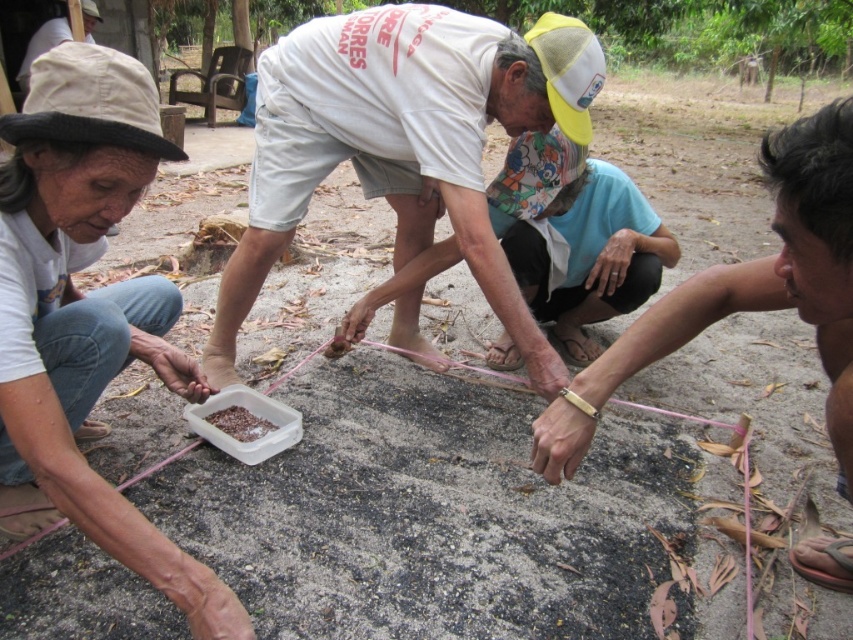
Is white cotton shirt at center below white cotton shirt at lower left?

No, white cotton shirt at center is not below white cotton shirt at lower left.

Identify the location of white cotton shirt at center. (404, 141).

The image size is (853, 640). Identify the location of white cotton shirt at center. (404, 141).

Is gray concrete rock at lower left positioned behind brown matte food at center?

No, it is in front of brown matte food at center.

Between gray concrete rock at lower left and brown matte food at center, which one appears on the left side from the viewer's perspective?

brown matte food at center

Which is behind, point (323, 452) or point (267, 422)?

The point (267, 422) is more distant.

You are a GUI agent. You are given a task and a screenshot of the screen. Output one action in this format:
    pyautogui.click(x=<x>, y=<y>)
    Task: Click on the gray concrete rock at lower left
    The height and width of the screenshot is (640, 853).
    Given the screenshot: What is the action you would take?
    pyautogui.click(x=436, y=515)

Where is `white cotton shirt at center`? The image size is (853, 640). white cotton shirt at center is located at coordinates (404, 141).

Between white cotton shirt at center and brown matte food at center, which one appears on the right side from the viewer's perspective?

white cotton shirt at center

Is point (349, 72) closer to camera compared to point (219, 412)?

Yes, it is.

What are the coordinates of `white cotton shirt at center` in the screenshot? It's located at (404, 141).